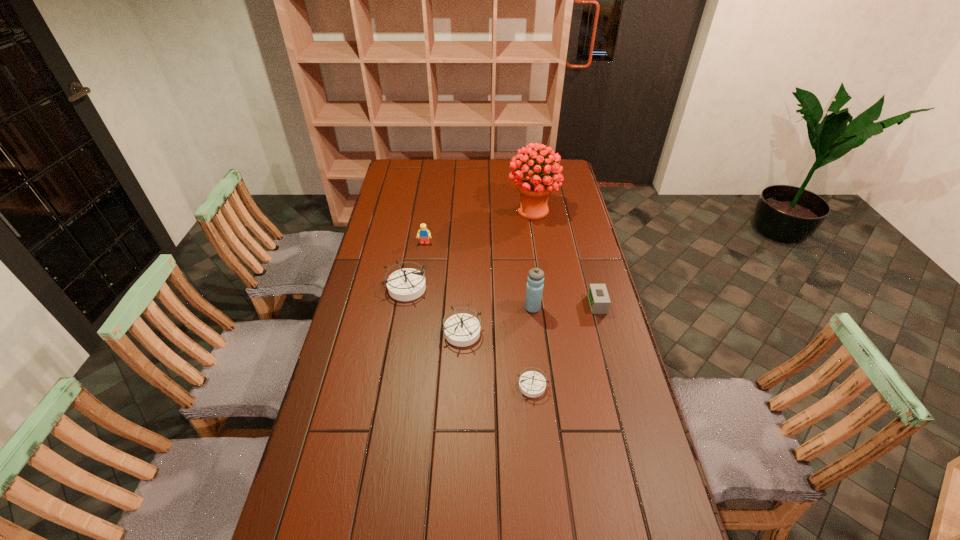
The width and height of the screenshot is (960, 540). Identify the location of vacant region between the sixth shortest object and the farthest object. (533, 259).

Where is `vacant point located between the alarm clock and the second tallest object`? vacant point located between the alarm clock and the second tallest object is located at coordinates (565, 306).

Find the location of a particular element. Image resolution: width=960 pixels, height=540 pixels. free spot between the farthest compass and the water bottle is located at coordinates (469, 298).

Where is `free space between the leftmost compass and the water bottle`? The width and height of the screenshot is (960, 540). free space between the leftmost compass and the water bottle is located at coordinates (469, 298).

You are a GUI agent. You are given a task and a screenshot of the screen. Output one action in this format:
    pyautogui.click(x=<x>, y=<y>)
    Task: Click on the free space between the water bottle and the bouquet
    The height and width of the screenshot is (540, 960).
    Given the screenshot: What is the action you would take?
    pyautogui.click(x=533, y=259)

Identify which object is the fifth closest to the alarm clock. Please provide its 2D coordinates. Your answer should be formatted as a tuple, i.e. [(x, y)], where the tuple contains the x and y coordinates of a point satisfying the conditions above.

[(407, 284)]

Identify the location of the fifth closest object to the second shortest compass. The height and width of the screenshot is (540, 960). (424, 234).

You are a GUI agent. You are given a task and a screenshot of the screen. Output one action in this format:
    pyautogui.click(x=<x>, y=<y>)
    Task: Click on the compass that is the closest to the farthest compass
    The height and width of the screenshot is (540, 960).
    Given the screenshot: What is the action you would take?
    pyautogui.click(x=462, y=329)

Select which compass appears as the third closest to the sixth shortest object. Please provide its 2D coordinates. Your answer should be formatted as a tuple, i.e. [(x, y)], where the tuple contains the x and y coordinates of a point satisfying the conditions above.

[(407, 284)]

I want to click on free location that satisfies the following two spatial constraints: 1. on the front-facing side of the shortest compass; 2. on the left side of the second farthest object, so click(404, 385).